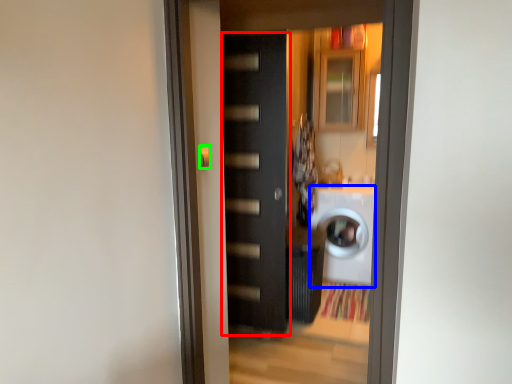
Question: Which object is positioned farthest from door (highlighted by a red box)? Select from washing machine (highlighted by a blue box) and door handle (highlighted by a green box).

Choices:
 (A) washing machine
 (B) door handle

Answer: (B)